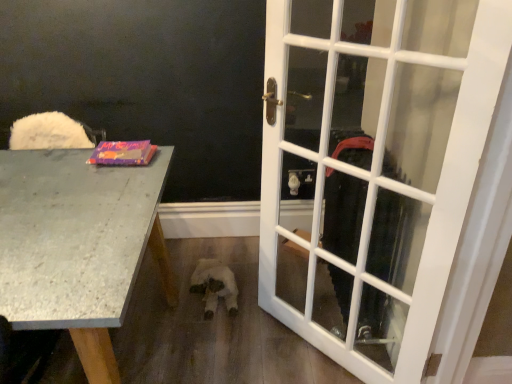
Locate an element on the screen. unoccupied space behind white plush toy at center is located at coordinates (220, 246).